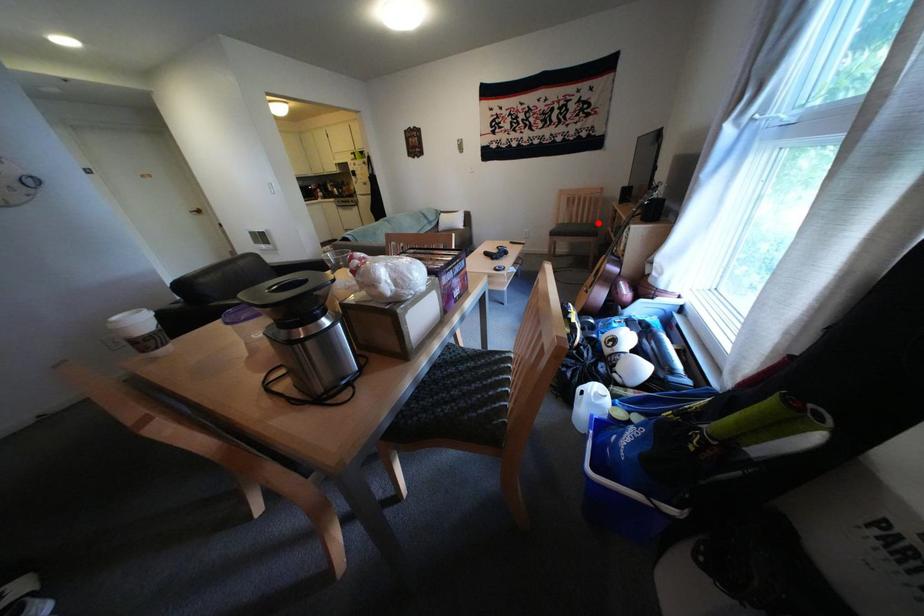
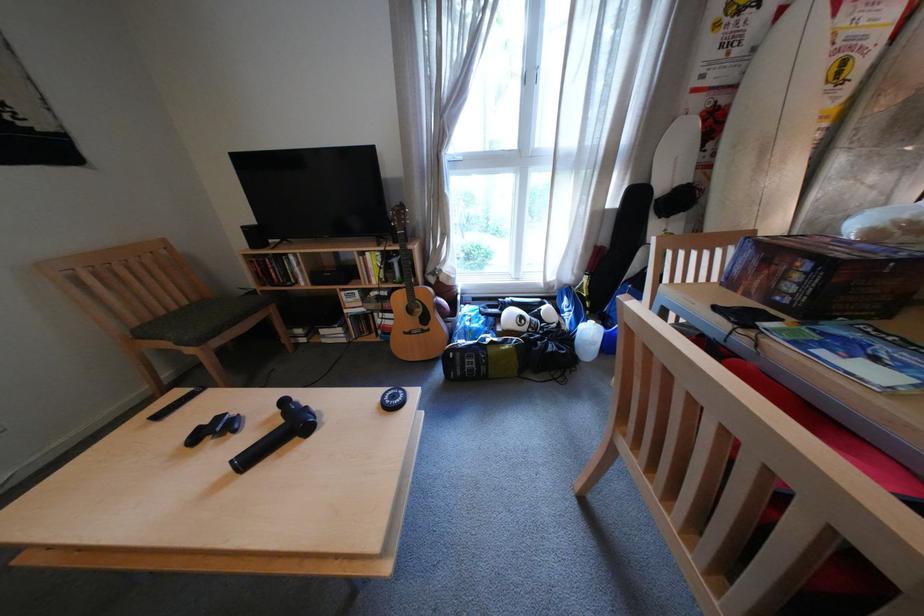
Question: I am providing you with two images of the same scene from different viewpoints. A red point is marked on the first image. Can you still see the location of the red point in image 2?

Choices:
 (A) Yes
 (B) No

Answer: (A)